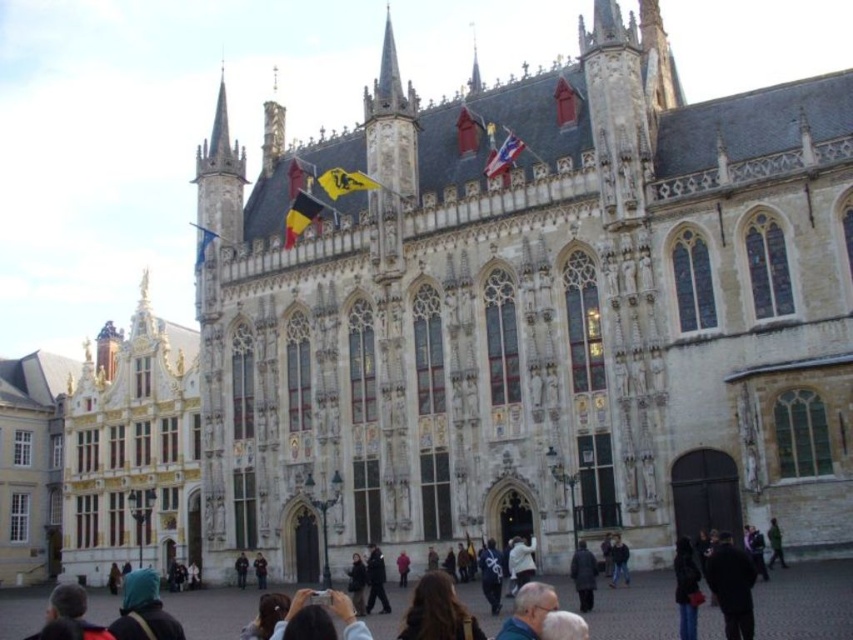
Question: Which of the following is the farthest from the observer?

Choices:
 (A) dark gray coat at center
 (B) black leather jacket at lower right

Answer: (A)

Question: Does black leather jacket at lower right appear on the right side of dark gray coat at center?

Choices:
 (A) yes
 (B) no

Answer: (A)

Question: Which of the following is the farthest from the observer?

Choices:
 (A) (410, 632)
 (B) (361, 602)

Answer: (B)

Question: Which point is farther from the camera taking this photo?

Choices:
 (A) (425, 595)
 (B) (573, 552)

Answer: (B)

Question: Is dark blue hooded jacket at lower left smaller than matte silver phone at center?

Choices:
 (A) yes
 (B) no

Answer: (B)

Question: Is the position of brown hair at center more distant than that of dark blue hooded jacket at lower left?

Choices:
 (A) yes
 (B) no

Answer: (B)